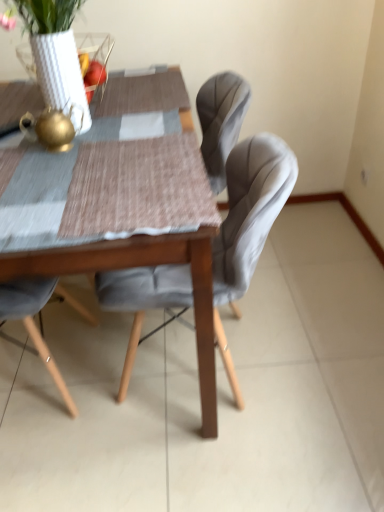
Question: From the image's perspective, would you say velvet grey chair at center is shown under wooden table at center?

Choices:
 (A) no
 (B) yes

Answer: (B)

Question: Is velvet grey chair at center closer to the viewer compared to wooden table at center?

Choices:
 (A) yes
 (B) no

Answer: (B)

Question: Can you confirm if velvet grey chair at center is taller than wooden table at center?

Choices:
 (A) no
 (B) yes

Answer: (A)

Question: Is velvet grey chair at center at the right side of wooden table at center?

Choices:
 (A) no
 (B) yes

Answer: (B)

Question: Considering the relative sizes of velvet grey chair at center and wooden table at center in the image provided, is velvet grey chair at center thinner than wooden table at center?

Choices:
 (A) no
 (B) yes

Answer: (B)

Question: Is white textured vase at upper left bigger or smaller than velvet grey chair at center?

Choices:
 (A) big
 (B) small

Answer: (B)

Question: Is white textured vase at upper left spatially inside velvet grey chair at center, or outside of it?

Choices:
 (A) inside
 (B) outside

Answer: (B)

Question: Does point (44, 32) appear closer or farther from the camera than point (144, 274)?

Choices:
 (A) farther
 (B) closer

Answer: (B)

Question: In terms of width, does white textured vase at upper left look wider or thinner when compared to velvet grey chair at center?

Choices:
 (A) thin
 (B) wide

Answer: (A)

Question: Is velvet grey chair at center to the left or to the right of white textured vase at upper left in the image?

Choices:
 (A) right
 (B) left

Answer: (A)

Question: Considering the positions of velvet grey chair at center and white textured vase at upper left in the image, is velvet grey chair at center wider or thinner than white textured vase at upper left?

Choices:
 (A) thin
 (B) wide

Answer: (B)

Question: Looking at the image, does velvet grey chair at center seem bigger or smaller compared to white textured vase at upper left?

Choices:
 (A) big
 (B) small

Answer: (A)

Question: Considering the positions of point pos(241,144) and point pos(81,91), is point pos(241,144) closer or farther from the camera than point pos(81,91)?

Choices:
 (A) closer
 (B) farther

Answer: (B)

Question: Considering their positions, is velvet grey chair at center located in front of or behind wooden table at center?

Choices:
 (A) front
 (B) behind

Answer: (B)

Question: Looking at their shapes, would you say velvet grey chair at center is wider or thinner than wooden table at center?

Choices:
 (A) wide
 (B) thin

Answer: (B)